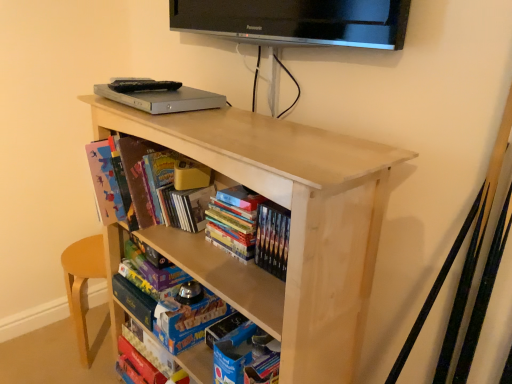
Question: From the image's perspective, does hardcover books at center, which is the second book from bottom to top, appear lower than hardcover book at center, the second book positioned from the top?

Choices:
 (A) no
 (B) yes

Answer: (B)

Question: Can you see hardcover books at center, arranged as the third book when viewed from the top, touching hardcover book at center, acting as the 3th book starting from the bottom?

Choices:
 (A) yes
 (B) no

Answer: (B)

Question: Can you confirm if hardcover books at center, arranged as the third book when viewed from the top, is bigger than hardcover book at center, acting as the 3th book starting from the bottom?

Choices:
 (A) yes
 (B) no

Answer: (B)

Question: Does hardcover books at center, which is the second book from bottom to top, have a greater height compared to hardcover book at center, acting as the 3th book starting from the bottom?

Choices:
 (A) yes
 (B) no

Answer: (B)

Question: Is hardcover books at center, which is the second book from bottom to top, wider than hardcover book at center, acting as the 3th book starting from the bottom?

Choices:
 (A) yes
 (B) no

Answer: (B)

Question: Relative to blue cardboard book at lower center, is matte cardboard book at upper left, the 4th book in the bottom-to-top sequence, in front or behind?

Choices:
 (A) front
 (B) behind

Answer: (A)

Question: Is matte cardboard book at upper left, the 4th book in the bottom-to-top sequence, inside the boundaries of blue cardboard book at lower center, or outside?

Choices:
 (A) inside
 (B) outside

Answer: (B)

Question: Is matte cardboard book at upper left, the first book when ordered from top to bottom, bigger or smaller than blue cardboard book at lower center?

Choices:
 (A) small
 (B) big

Answer: (B)

Question: Considering the positions of point (130, 178) and point (168, 306), is point (130, 178) closer or farther from the camera than point (168, 306)?

Choices:
 (A) closer
 (B) farther

Answer: (A)

Question: Is point (125, 339) positioned closer to the camera than point (258, 248)?

Choices:
 (A) farther
 (B) closer

Answer: (A)

Question: From a real-world perspective, is matte cardboard book at lower center, the 1th book positioned from the bottom, physically located above or below hardcover books at center, which is the second book from bottom to top?

Choices:
 (A) below
 (B) above

Answer: (A)

Question: Do you think matte cardboard book at lower center, the 1th book positioned from the bottom, is within hardcover books at center, arranged as the third book when viewed from the top, or outside of it?

Choices:
 (A) inside
 (B) outside

Answer: (B)

Question: Is matte cardboard book at lower center, the 1th book positioned from the bottom, bigger or smaller than hardcover books at center, which is the second book from bottom to top?

Choices:
 (A) small
 (B) big

Answer: (A)

Question: Visually, is hardcover books at center, which is the second book from bottom to top, positioned to the left or to the right of natural wood shelf at center?

Choices:
 (A) right
 (B) left

Answer: (A)

Question: Is hardcover books at center, which is the second book from bottom to top, wider or thinner than natural wood shelf at center?

Choices:
 (A) wide
 (B) thin

Answer: (B)